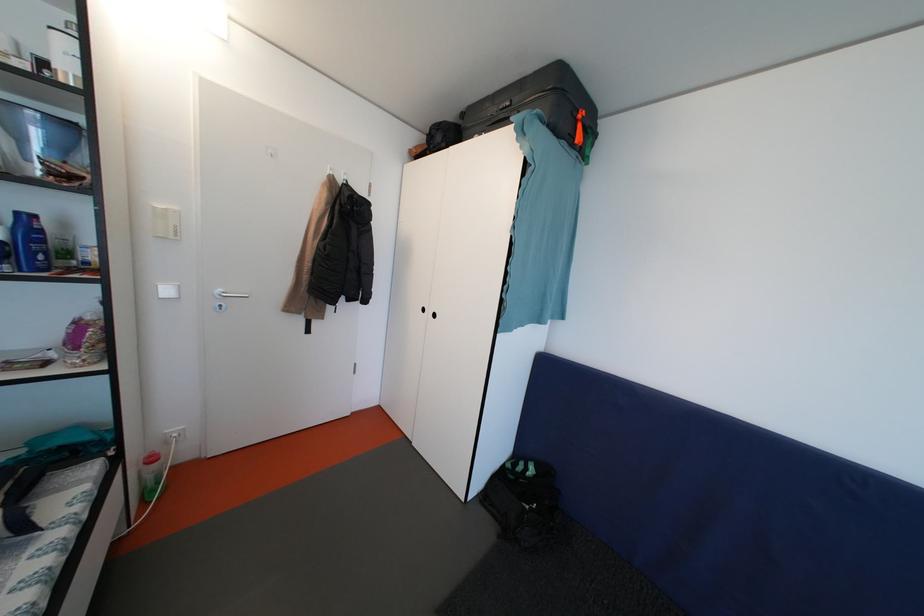
Where would you push the silver light switch? Please return your answer as a coordinate pair (x, y).

(165, 222)